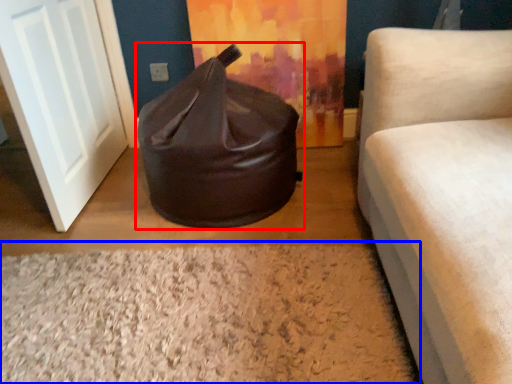
Question: Which point is closer to the camera, bean bag chair (highlighted by a red box) or granite (highlighted by a blue box)?

Choices:
 (A) bean bag chair
 (B) granite

Answer: (B)